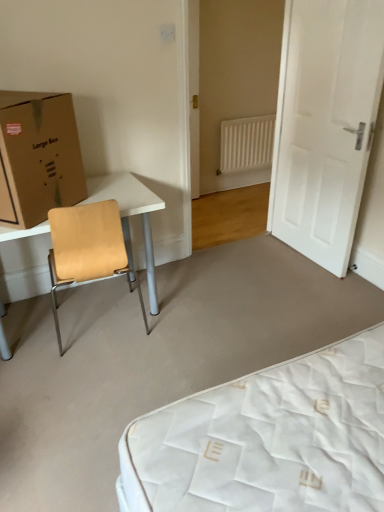
Find the location of a particular element. The width and height of the screenshot is (384, 512). free point above white plastic radiator at center (from a real-world perspective) is located at coordinates (253, 115).